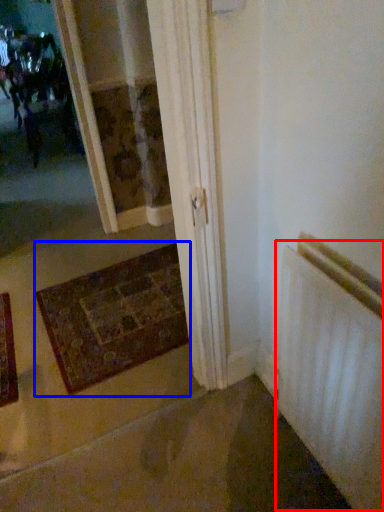
Question: Which point is closer to the camera, radiator (highlighted by a red box) or mat (highlighted by a blue box)?

Choices:
 (A) radiator
 (B) mat

Answer: (A)